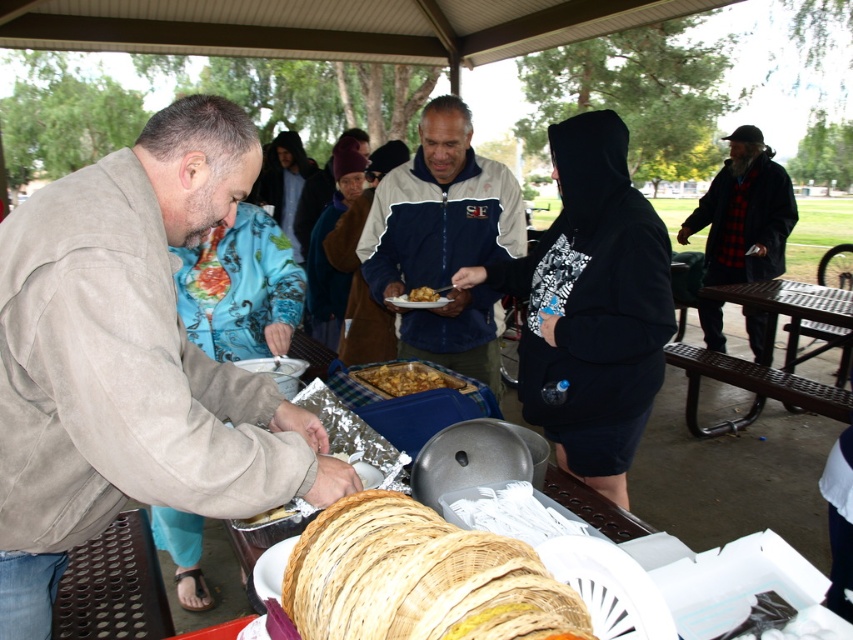
You are organizing a picnic and need to place the navy blue jacket at center and the brown metal picnic table at right in your setup. Based on their sizes, which object should you place first to ensure proper arrangement?

The navy blue jacket at center is smaller than the brown metal picnic table at right, so you should place the brown metal picnic table at right first as it requires more space and is larger in size.

You are standing in the park and see the navy blue jacket at center and the brown metal picnic table at right. Which object is nearer to you?

The navy blue jacket at center is closer to the viewer than the brown metal picnic table at right, so the navy blue jacket at center is nearer.

You are standing at the edge of the pavilion and want to grab a roll from the brown woven basket at lower center without moving your feet. Can you reach it?

The brown woven basket at lower center is 18.71 inches away from viewer, so yes, you can reach it since it is within arm reach.